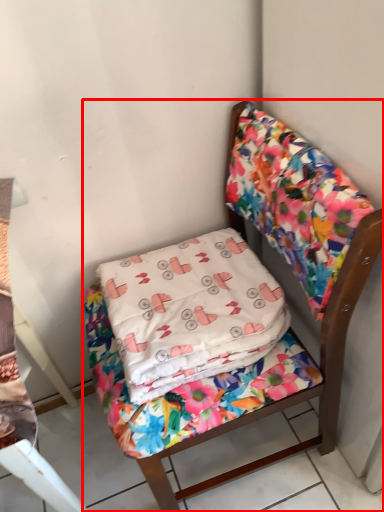
Question: From the image's perspective, what is the correct spatial positioning of chair (annotated by the red box) in reference to pillow?

Choices:
 (A) below
 (B) above

Answer: (A)